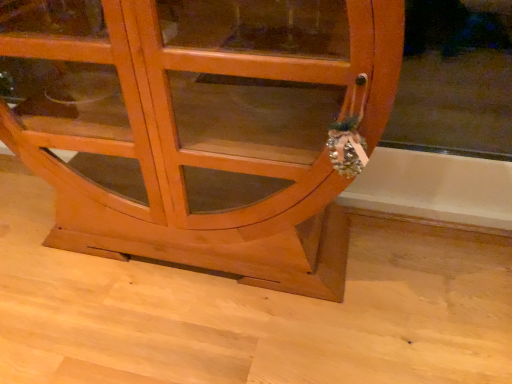
Find the location of `free point in front of matte wood cabinet at center`. free point in front of matte wood cabinet at center is located at coordinates (185, 327).